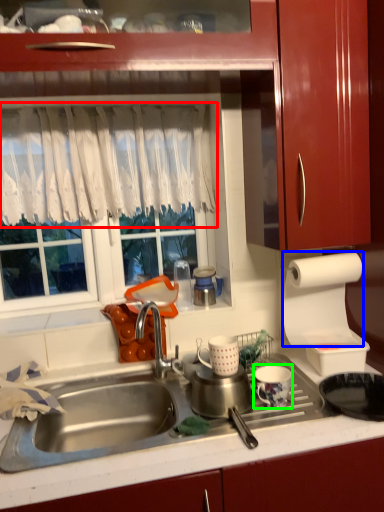
Question: Considering the real-world distances, which object is closest to curtain (highlighted by a red box)? paper towel (highlighted by a blue box) or tableware (highlighted by a green box).

Choices:
 (A) paper towel
 (B) tableware

Answer: (A)